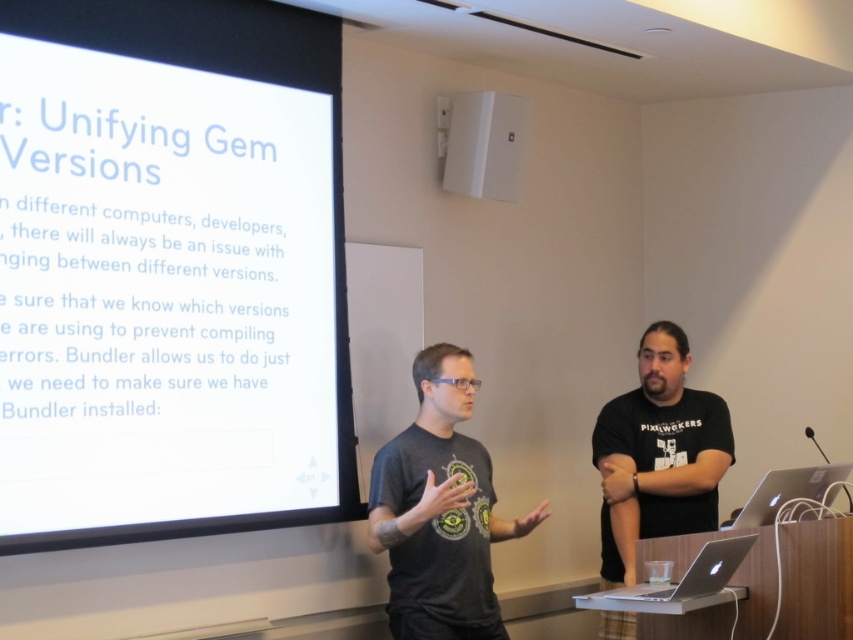
Question: Which of the following is the farthest from the observer?

Choices:
 (A) (467, 385)
 (B) (662, 525)
 (C) (175, 68)

Answer: (B)

Question: Estimate the real-world distances between objects in this image. Which object is closer to the white matte projector screen at upper left?

Choices:
 (A) dark gray t-shirt at center
 (B) white plastic speaker at upper center

Answer: (A)

Question: Which object is the closest to the white plastic speaker at upper center?

Choices:
 (A) dark gray t-shirt at center
 (B) white matte projector screen at upper left

Answer: (B)

Question: Does dark gray t-shirt at center appear on the left side of black matte t-shirt at center?

Choices:
 (A) yes
 (B) no

Answer: (A)

Question: Can you confirm if white matte projector screen at upper left is wider than black matte t-shirt at center?

Choices:
 (A) no
 (B) yes

Answer: (B)

Question: Is white matte projector screen at upper left wider than white plastic speaker at upper center?

Choices:
 (A) no
 (B) yes

Answer: (B)